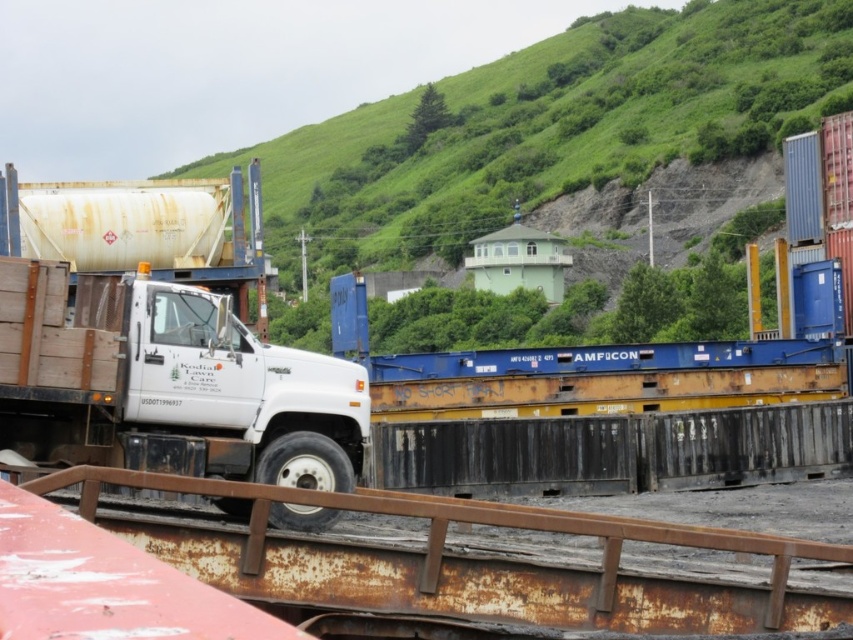
Question: Which is nearer to the green grassy hillside at upper center?

Choices:
 (A) white matte truck at center
 (B) rusty metal rail at lower center

Answer: (A)

Question: Among these points, which one is farthest from the camera?

Choices:
 (A) (120, 532)
 (B) (352, 376)

Answer: (B)

Question: Can you confirm if green grassy hillside at upper center is thinner than white matte truck at center?

Choices:
 (A) yes
 (B) no

Answer: (B)

Question: Can you confirm if rusty metal rail at lower center is positioned to the left of white matte truck at center?

Choices:
 (A) no
 (B) yes

Answer: (A)

Question: Is green grassy hillside at upper center above rusty metal rail at lower center?

Choices:
 (A) yes
 (B) no

Answer: (A)

Question: Estimate the real-world distances between objects in this image. Which object is closer to the green grassy hillside at upper center?

Choices:
 (A) rusty metal rail at lower center
 (B) white matte truck at center

Answer: (B)